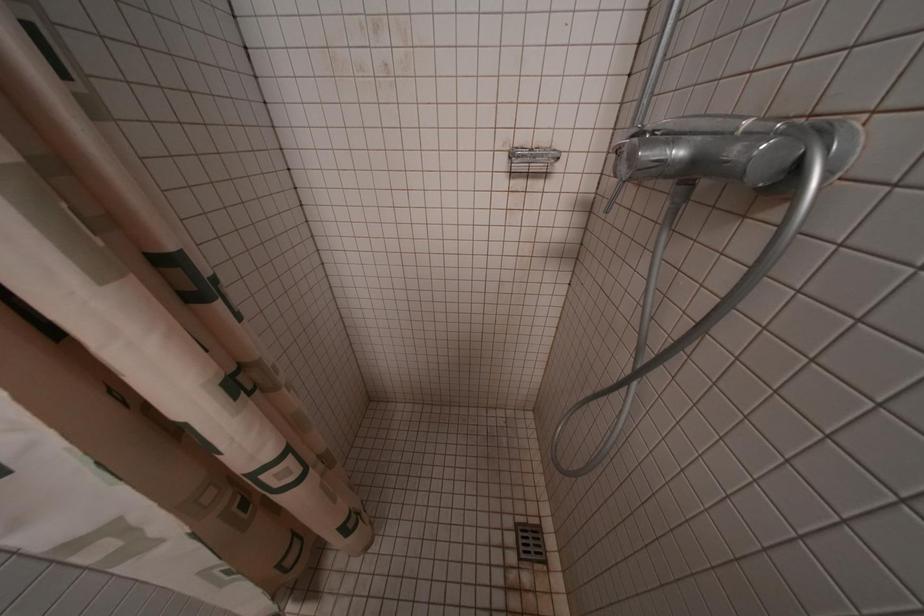
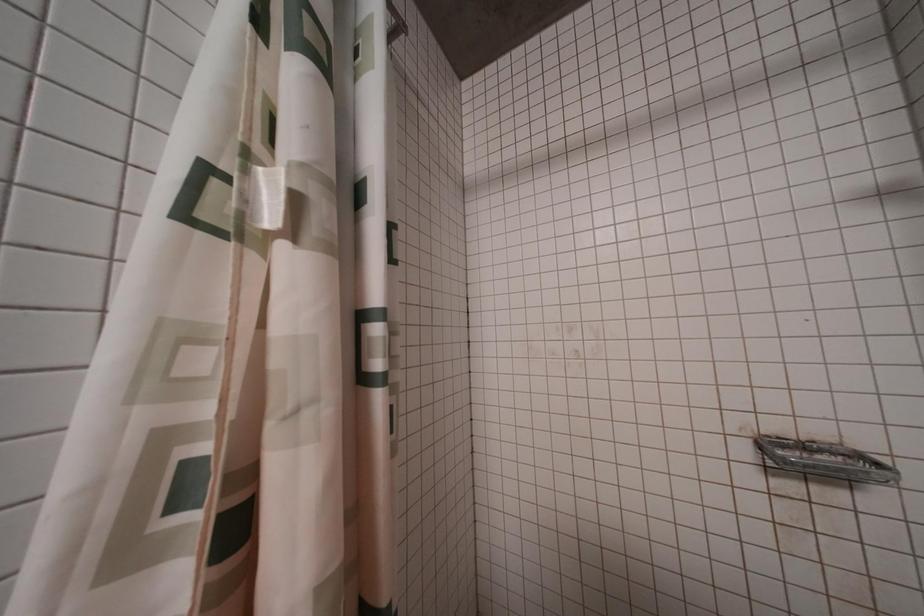
First-person continuous shooting, in which direction is the camera rotating?

The camera's rotation is toward left-up.